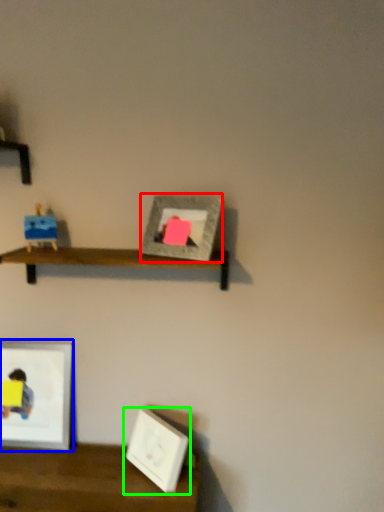
Question: Based on their relative distances, which object is farther from picture frame (highlighted by a red box)? Choose from picture frame (highlighted by a blue box) and picture frame (highlighted by a green box).

Choices:
 (A) picture frame
 (B) picture frame

Answer: (A)